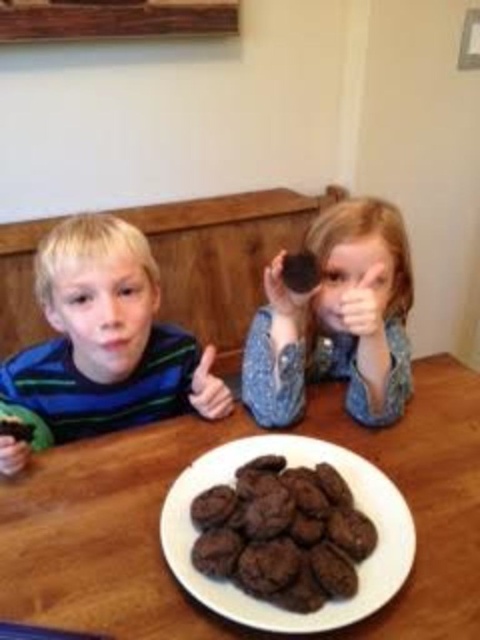
Is matte blue shirt at left behind matte plastic hand at lower left?

Yes, it is behind matte plastic hand at lower left.

Is matte blue shirt at left in front of matte plastic hand at lower left?

That is False.

Who is more forward, (56, 378) or (0, 465)?

Point (0, 465)

This screenshot has width=480, height=640. Identify the location of matte blue shirt at left. (105, 340).

Is white matte plate at center to the left of matte plastic hand at lower left from the viewer's perspective?

No, white matte plate at center is not to the left of matte plastic hand at lower left.

From the picture: Which is above, white matte plate at center or matte plastic hand at lower left?

matte plastic hand at lower left

Which is behind, point (236, 616) or point (22, 449)?

The point (22, 449) is more distant.

Find the location of `white matte plate at center`. white matte plate at center is located at coordinates (290, 467).

Does matte blue shirt at left have a lesser width compared to matte black cookie at upper center?

No.

Identify the location of matte blue shirt at left. The image size is (480, 640). (105, 340).

Which is in front, point (81, 216) or point (288, 300)?

Point (288, 300) is more forward.

Find the location of a particular element. This screenshot has width=480, height=640. matte blue shirt at left is located at coordinates (105, 340).